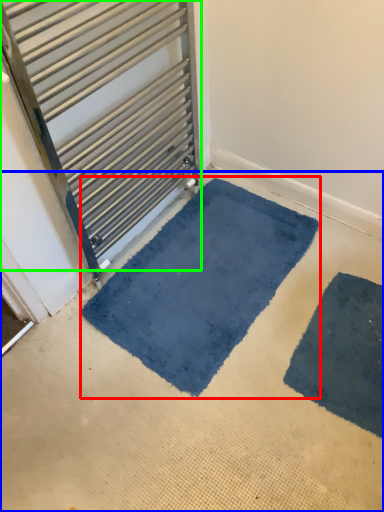
Question: Considering the real-world distances, which object is closest to mat (highlighted by a red box)? concrete (highlighted by a blue box) or door (highlighted by a green box).

Choices:
 (A) concrete
 (B) door

Answer: (A)